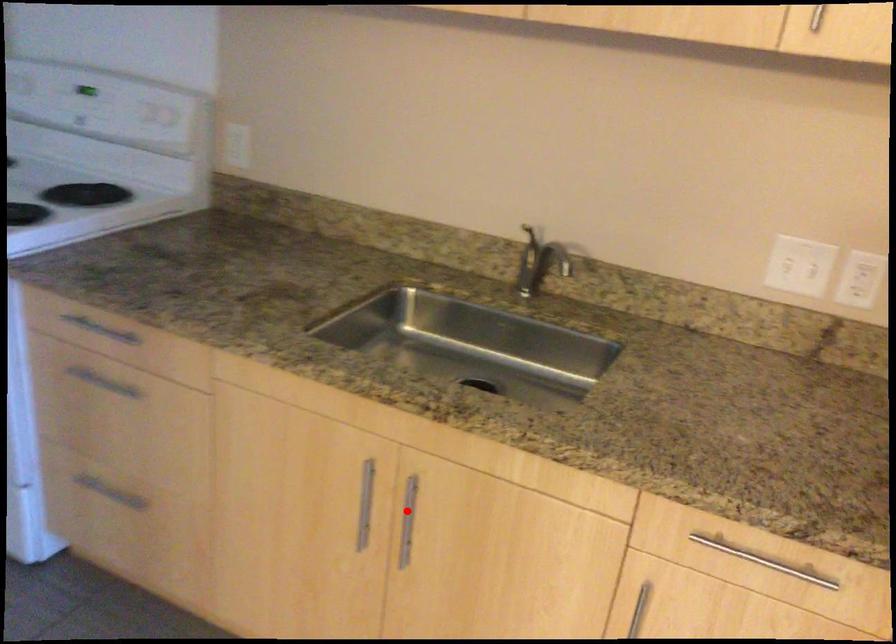
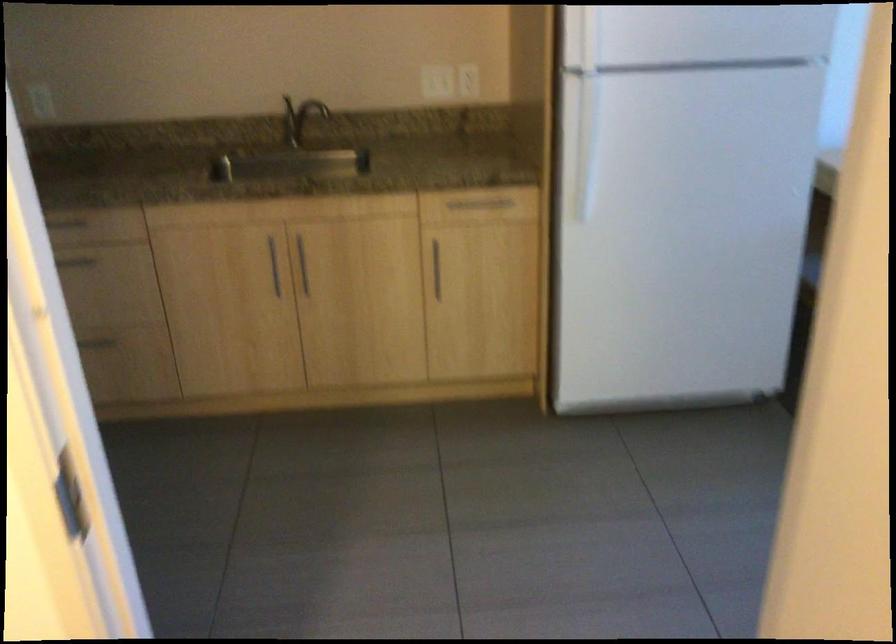
Find the pixel in the second image that matches the highlighted location in the first image.

(303, 265)